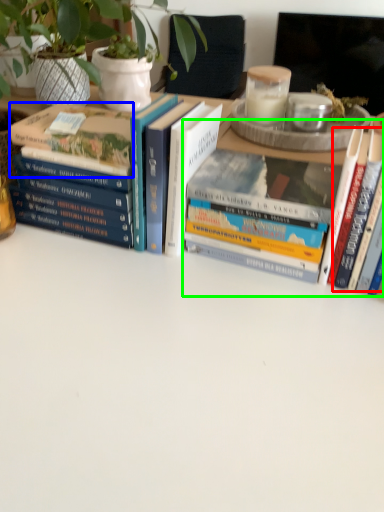
Question: Which is farther away from book (highlighted by a red box)? book (highlighted by a blue box) or book (highlighted by a green box)?

Choices:
 (A) book
 (B) book

Answer: (A)